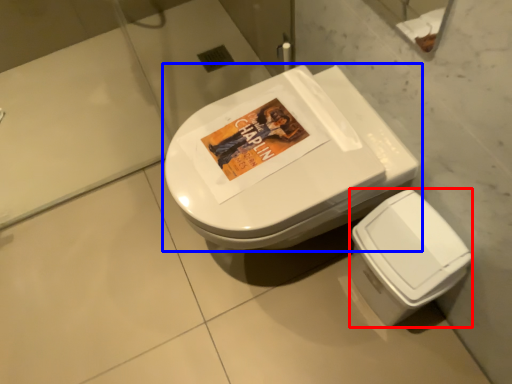
Question: Which point is closer to the camera, bidet (highlighted by a red box) or toilet (highlighted by a blue box)?

Choices:
 (A) bidet
 (B) toilet

Answer: (B)